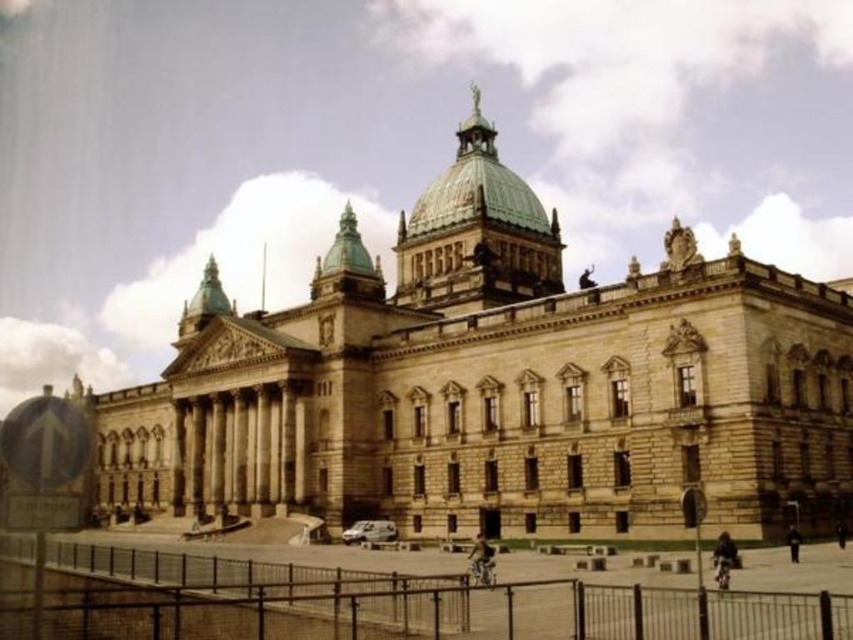
Question: Is stone building at center smaller than metallic chain-link fence at lower center?

Choices:
 (A) yes
 (B) no

Answer: (B)

Question: Among these objects, which one is nearest to the camera?

Choices:
 (A) metallic chain-link fence at lower center
 (B) stone building at center

Answer: (A)

Question: From the image, what is the correct spatial relationship of stone building at center in relation to metallic chain-link fence at lower center?

Choices:
 (A) right
 (B) left

Answer: (A)

Question: Which point is farther to the camera?

Choices:
 (A) (434, 428)
 (B) (170, 628)

Answer: (A)

Question: Does stone building at center appear on the left side of metallic chain-link fence at lower center?

Choices:
 (A) yes
 (B) no

Answer: (B)